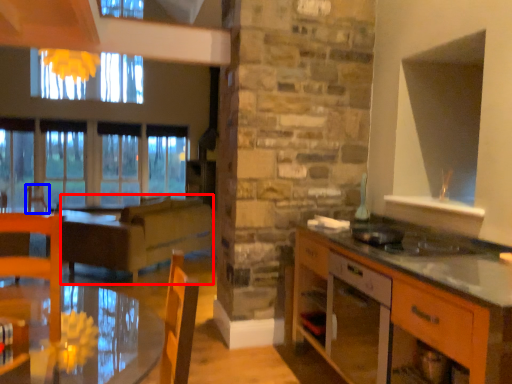
Question: Which object appears farthest to the camera in this image, surround (highlighted by a red box) or armchair (highlighted by a blue box)?

Choices:
 (A) surround
 (B) armchair

Answer: (B)